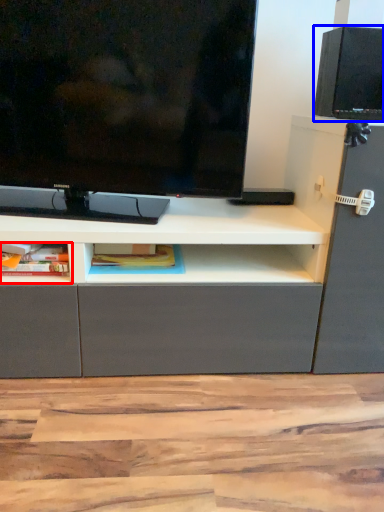
Question: Which of the following is the farthest to the observer, cabinet (highlighted by a red box) or speaker (highlighted by a blue box)?

Choices:
 (A) cabinet
 (B) speaker

Answer: (B)